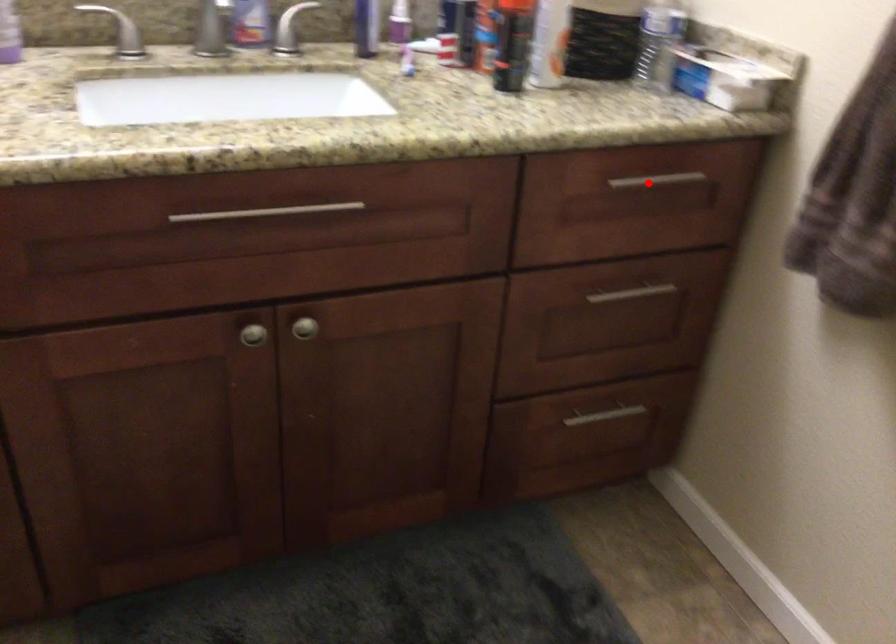
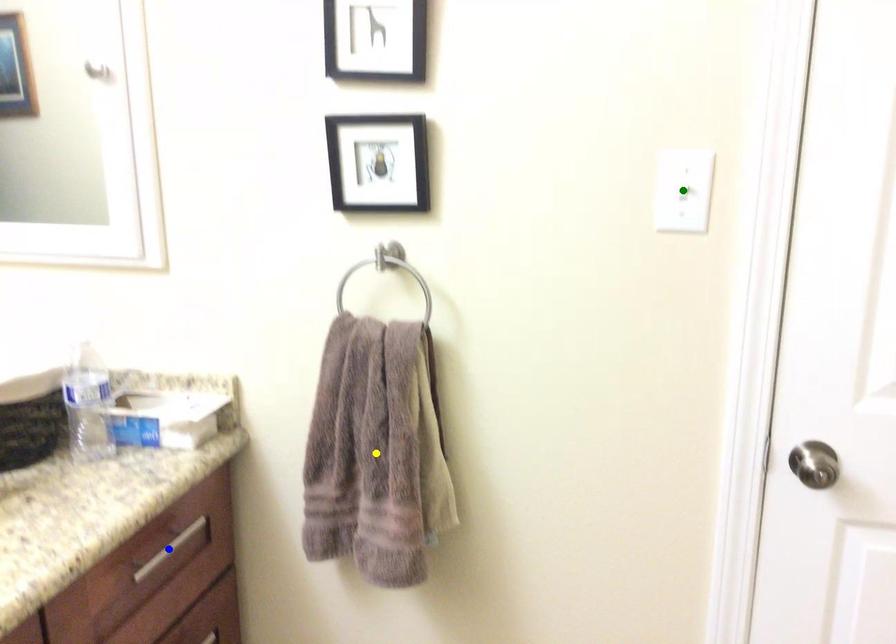
Question: I am providing you with two images of the same scene from different viewpoints. A red point is marked on the first image. You are given multiple points on the second image. Which mark in image 2 goes with the point in image 1?

Choices:
 (A) green point
 (B) yellow point
 (C) blue point

Answer: (C)